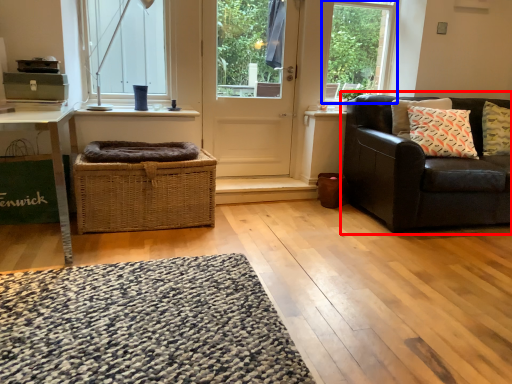
Question: Which object is further to the camera taking this photo, studio couch (highlighted by a red box) or window frame (highlighted by a blue box)?

Choices:
 (A) studio couch
 (B) window frame

Answer: (B)